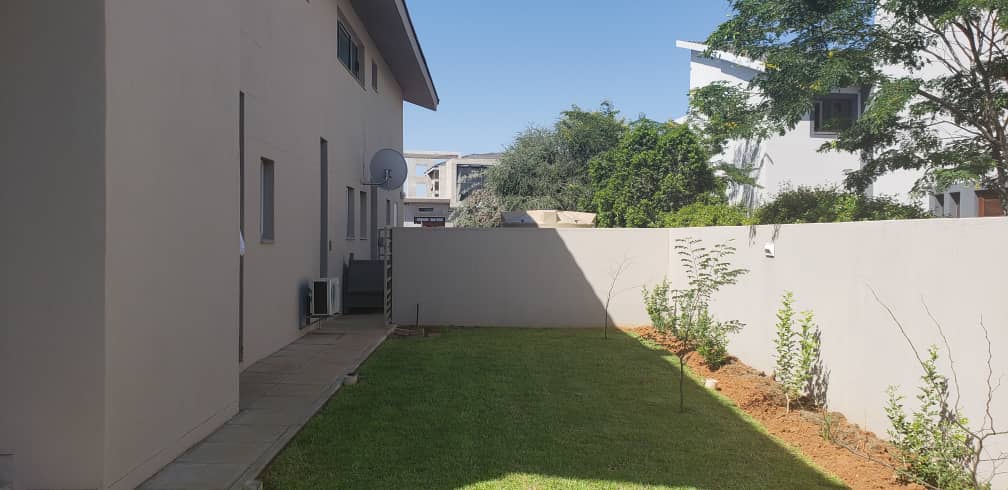
Identify the location of door. The width and height of the screenshot is (1008, 490). (373, 201).